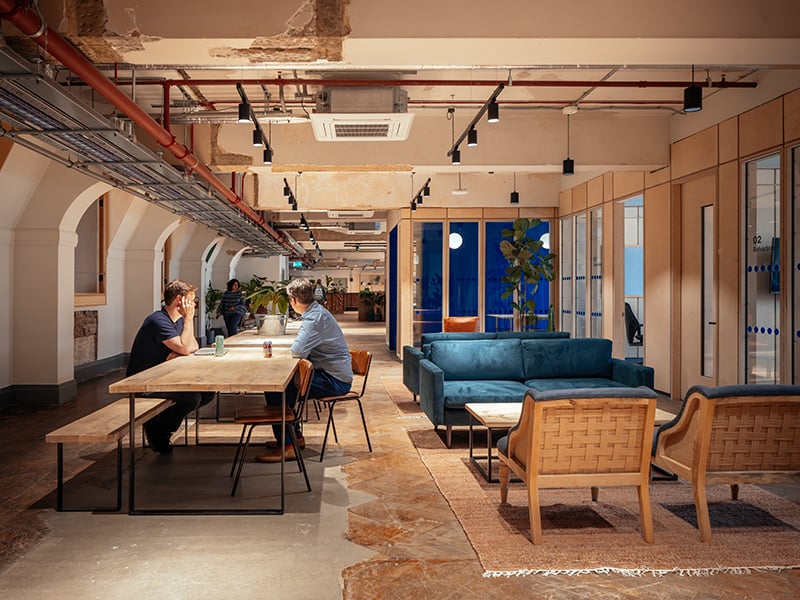
Identify the location of floor. (178, 567).